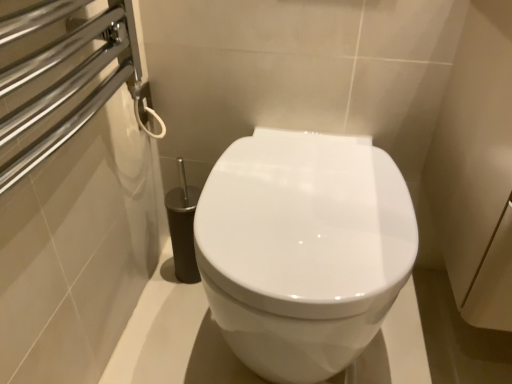
Find the location of a particular element. This screenshot has height=384, width=512. empty space that is ontop of white glossy toilet at center is located at coordinates (297, 183).